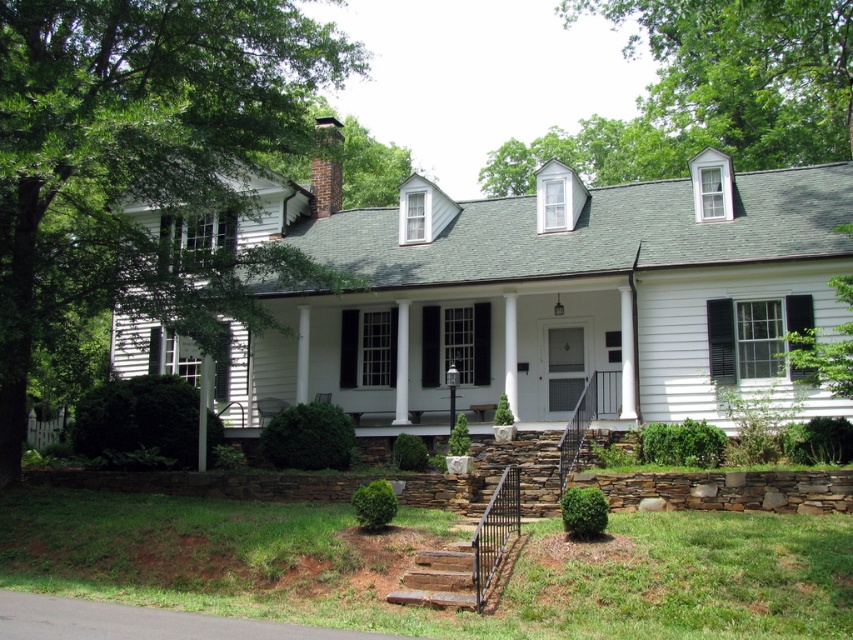
Which of these two, wooden stairs at lower center or brown brick chimney at upper center, stands shorter?

wooden stairs at lower center is shorter.

Describe the element at coordinates (445, 577) in the screenshot. The height and width of the screenshot is (640, 853). I see `wooden stairs at lower center` at that location.

Is point (445, 545) behind point (320, 172)?

No, it is in front of (320, 172).

Where is `wooden stairs at lower center`? Image resolution: width=853 pixels, height=640 pixels. wooden stairs at lower center is located at coordinates (445, 577).

Is white painted wood shutter at center thinner than brown brick chimney at upper center?

Yes, white painted wood shutter at center is thinner than brown brick chimney at upper center.

Does white painted wood shutter at center have a lesser height compared to brown brick chimney at upper center?

Yes.

The image size is (853, 640). I want to click on white painted wood shutter at center, so click(456, 342).

Is white painted wood shutter at center wider than wooden stairs at lower center?

Indeed, white painted wood shutter at center has a greater width compared to wooden stairs at lower center.

This screenshot has height=640, width=853. What are the coordinates of `white painted wood shutter at center` in the screenshot? It's located at (456, 342).

Locate an element on the screen. white painted wood shutter at center is located at coordinates (456, 342).